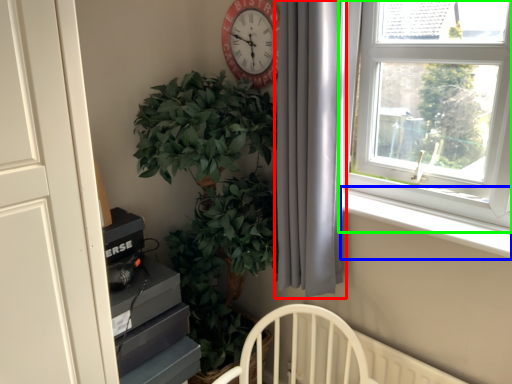
Question: Considering the real-world distances, which object is closest to curtain (highlighted by a red box)? window sill (highlighted by a blue box) or window (highlighted by a green box).

Choices:
 (A) window sill
 (B) window

Answer: (B)